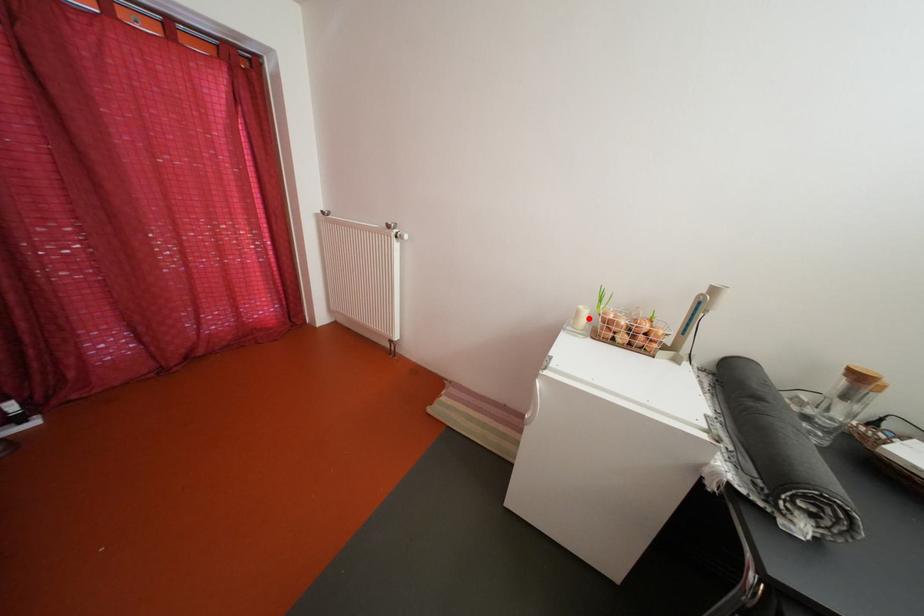
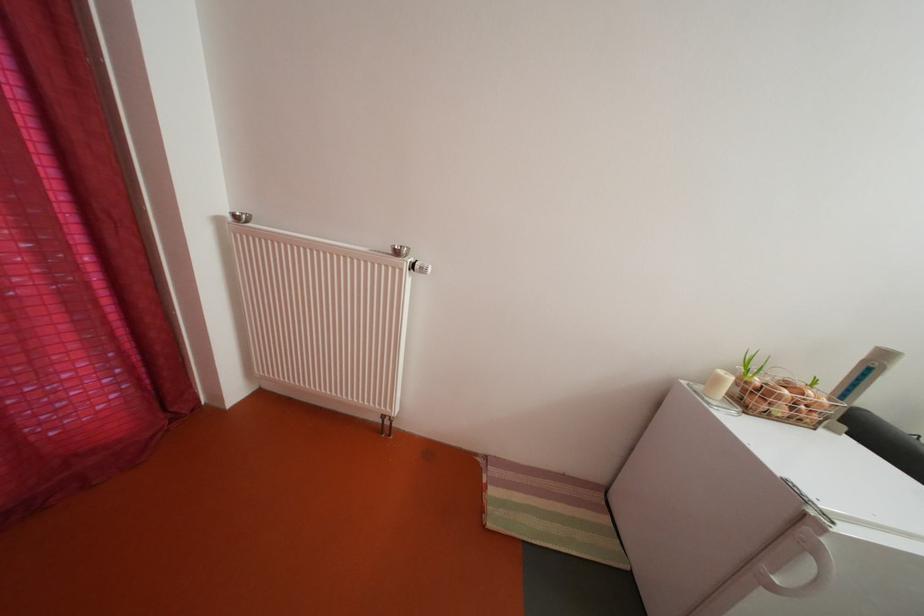
In the second image, find the point that corresponds to the highlighted location in the first image.

(728, 386)